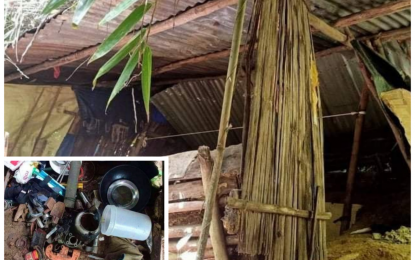
Locate an element on the screen. Image resolution: width=415 pixels, height=260 pixels. bowl is located at coordinates (128, 183), (87, 222).